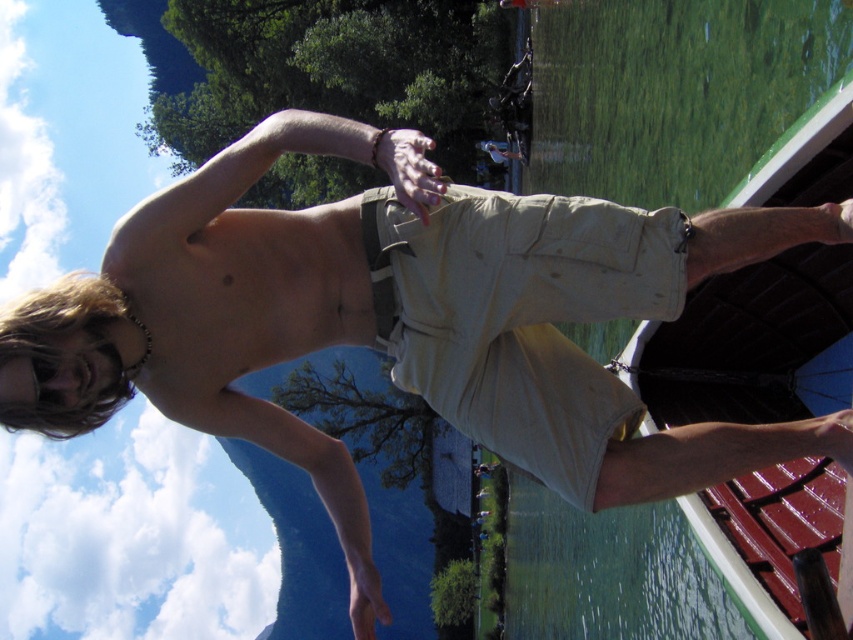
Does green smooth water at lower right appear over khaki cotton shorts at center?

No.

Who is more distant from viewer, (654, 506) or (498, 285)?

Positioned behind is point (654, 506).

Identify the location of green smooth water at lower right. The height and width of the screenshot is (640, 853). [691, 100].